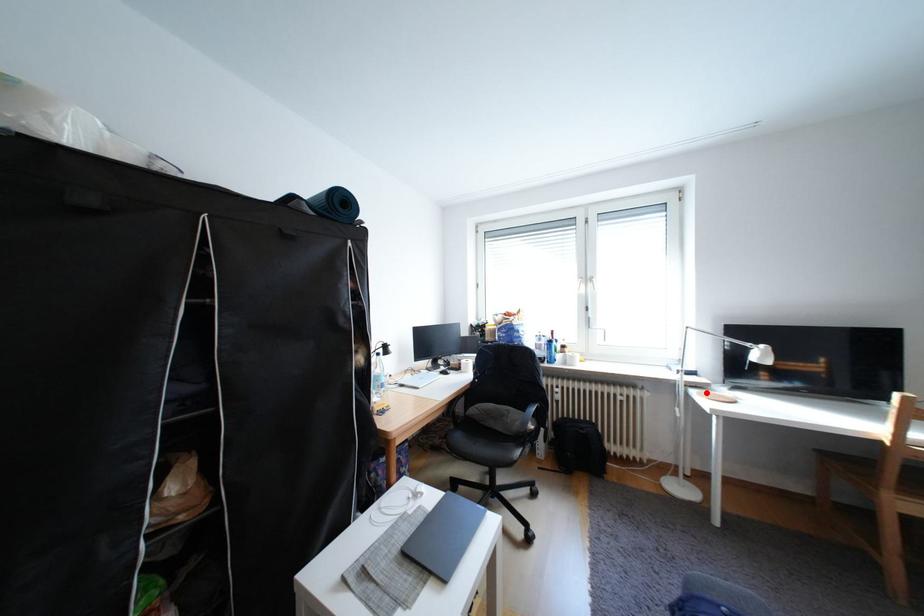
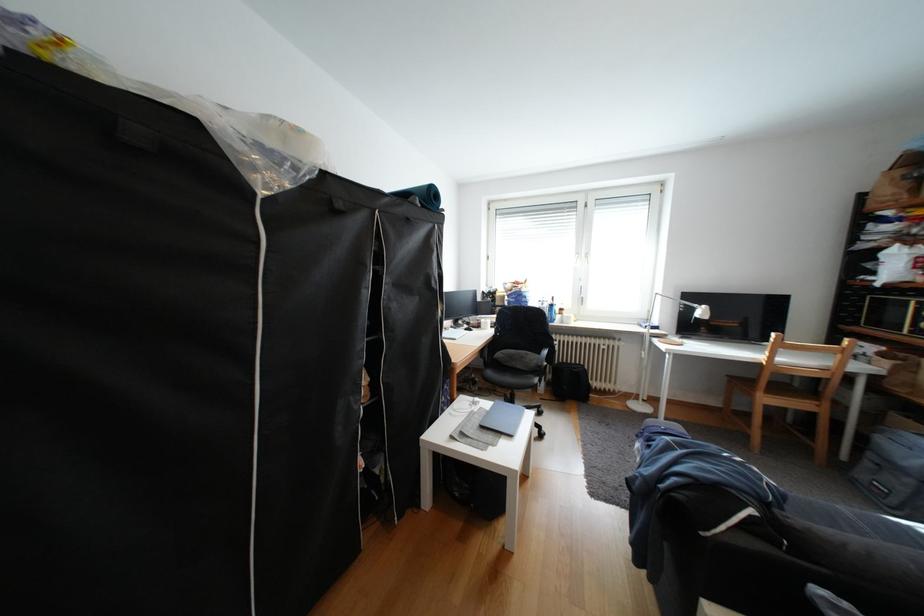
The point at the highlighted location is marked in the first image. Where is the corresponding point in the second image?

(667, 341)